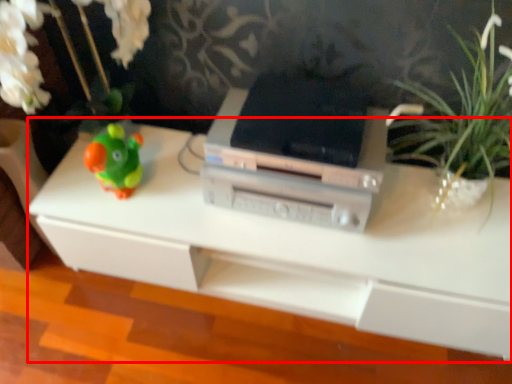
Question: From the image's perspective, considering the relative positions of table (annotated by the red box) and printer in the image provided, where is table (annotated by the red box) located with respect to the staircase?

Choices:
 (A) below
 (B) above

Answer: (A)